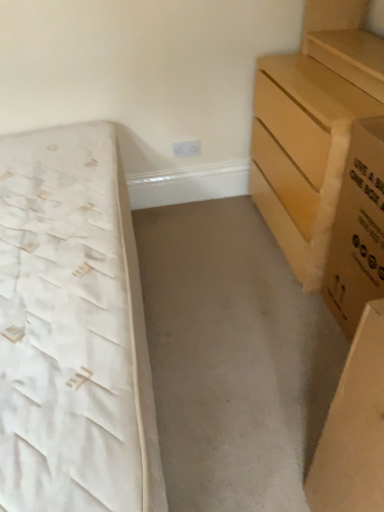
Question: Is light brown wooden chest of drawers at right a part of brown cardboard box at right?

Choices:
 (A) yes
 (B) no

Answer: (B)

Question: Considering the relative positions of brown cardboard box at right and light brown wooden chest of drawers at right in the image provided, is brown cardboard box at right in front of light brown wooden chest of drawers at right?

Choices:
 (A) yes
 (B) no

Answer: (A)

Question: From the image's perspective, would you say brown cardboard box at right is shown under light brown wooden chest of drawers at right?

Choices:
 (A) yes
 (B) no

Answer: (A)

Question: Considering the relative positions of brown cardboard box at right and light brown wooden chest of drawers at right in the image provided, is brown cardboard box at right to the left of light brown wooden chest of drawers at right from the viewer's perspective?

Choices:
 (A) no
 (B) yes

Answer: (A)

Question: Can you confirm if brown cardboard box at right is smaller than light brown wooden chest of drawers at right?

Choices:
 (A) no
 (B) yes

Answer: (B)

Question: Considering the positions of point (278, 217) and point (352, 291), is point (278, 217) closer or farther from the camera than point (352, 291)?

Choices:
 (A) closer
 (B) farther

Answer: (B)

Question: Is light brown wooden chest of drawers at right taller or shorter than brown cardboard box at right?

Choices:
 (A) tall
 (B) short

Answer: (A)

Question: Based on their sizes in the image, would you say light brown wooden chest of drawers at right is bigger or smaller than brown cardboard box at right?

Choices:
 (A) small
 (B) big

Answer: (B)

Question: Is light brown wooden chest of drawers at right in front of or behind brown cardboard box at right in the image?

Choices:
 (A) front
 (B) behind

Answer: (B)

Question: Is white fabric bed at left inside the boundaries of light brown wooden chest of drawers at right, or outside?

Choices:
 (A) outside
 (B) inside

Answer: (A)

Question: From the image's perspective, relative to light brown wooden chest of drawers at right, is white fabric bed at left above or below?

Choices:
 (A) below
 (B) above

Answer: (A)

Question: Is white fabric bed at left in front of or behind light brown wooden chest of drawers at right in the image?

Choices:
 (A) behind
 (B) front

Answer: (B)

Question: From a real-world perspective, is white fabric bed at left above or below light brown wooden chest of drawers at right?

Choices:
 (A) above
 (B) below

Answer: (B)

Question: Considering the positions of point (354, 225) and point (77, 253), is point (354, 225) closer or farther from the camera than point (77, 253)?

Choices:
 (A) closer
 (B) farther

Answer: (B)

Question: From the image's perspective, is brown cardboard box at right above or below white fabric bed at left?

Choices:
 (A) above
 (B) below

Answer: (A)